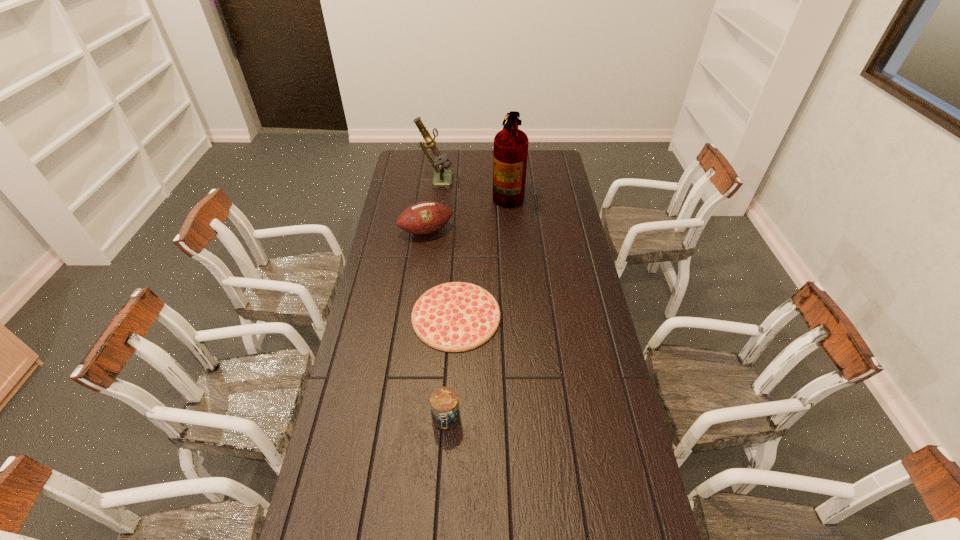
Identify which object is located as the second nearest to the shortest object. Please provide its 2D coordinates. Your answer should be formatted as a tuple, i.e. [(x, y)], where the tuple contains the x and y coordinates of a point satisfying the conditions above.

[(422, 218)]

Identify the location of vacant area that satisfies the following two spatial constraints: 1. at the nozzle of the tallest object; 2. on the lid of the jar. (525, 420).

Identify the location of free point that satisfies the following two spatial constraints: 1. on the back side of the pizza; 2. at the eyepiece of the microscope. The width and height of the screenshot is (960, 540). (x=463, y=178).

Where is `free location that satisfies the following two spatial constraints: 1. at the eyepiece of the microscope; 2. on the front side of the football (American)`? This screenshot has height=540, width=960. free location that satisfies the following two spatial constraints: 1. at the eyepiece of the microscope; 2. on the front side of the football (American) is located at coordinates (429, 231).

This screenshot has width=960, height=540. Identify the location of free space that satisfies the following two spatial constraints: 1. on the front side of the football (American); 2. on the right side of the shortest object. (415, 316).

The width and height of the screenshot is (960, 540). In order to click on vacant space that satisfies the following two spatial constraints: 1. at the nozzle of the tallest object; 2. on the lid of the nearest object in this screenshot , I will do `click(525, 420)`.